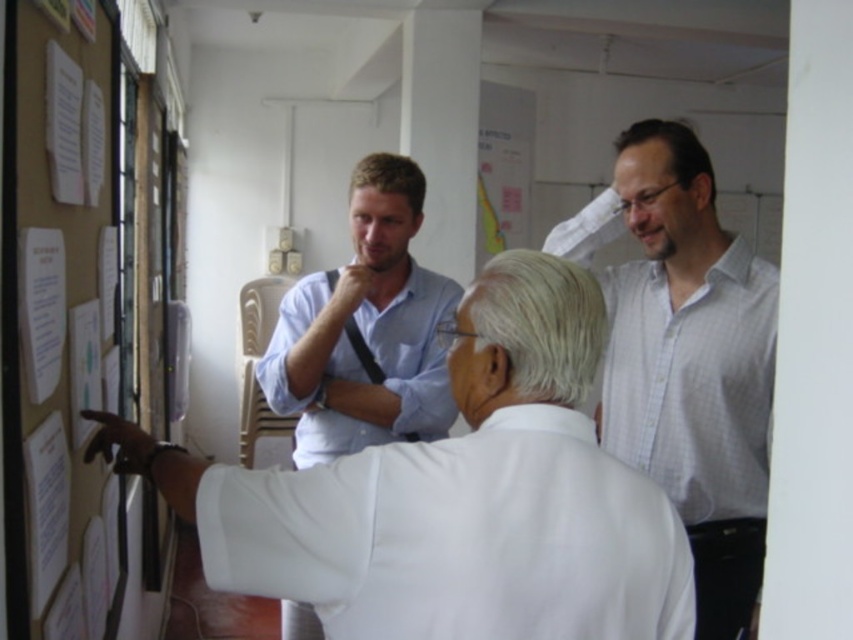
Which is behind, point (697, 154) or point (260, 387)?

Positioned behind is point (260, 387).

Does white checkered shirt at upper right appear on the right side of light blue cotton shirt at center?

Indeed, white checkered shirt at upper right is positioned on the right side of light blue cotton shirt at center.

Where is `white checkered shirt at upper right`? This screenshot has height=640, width=853. white checkered shirt at upper right is located at coordinates (686, 356).

Is light blue cotton shirt at center shorter than brown matte hair at center?

No, light blue cotton shirt at center is not shorter than brown matte hair at center.

Which is more to the right, light blue cotton shirt at center or brown matte hair at center?

Positioned to the right is brown matte hair at center.

Between point (434, 278) and point (422, 180), which one is positioned behind?

The point (434, 278) is more distant.

At what (x,y) coordinates should I click in order to perform the action: click on light blue cotton shirt at center. Please return your answer as a coordinate pair (x, y). This screenshot has width=853, height=640. Looking at the image, I should click on (376, 362).

Describe the element at coordinates (456, 497) in the screenshot. This screenshot has height=640, width=853. I see `white shirt at center` at that location.

Does white shirt at center appear on the right side of dark brown hair at upper right?

Incorrect, white shirt at center is not on the right side of dark brown hair at upper right.

Find the location of `white shirt at center`. white shirt at center is located at coordinates (456, 497).

Locate an element on the screen. The image size is (853, 640). white shirt at center is located at coordinates (456, 497).